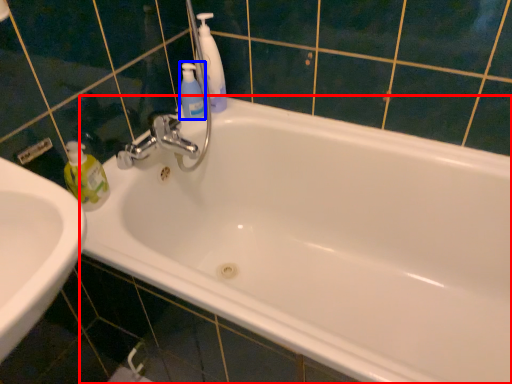
Question: Which point is further to the camera, bathtub (highlighted by a red box) or mouthwash (highlighted by a blue box)?

Choices:
 (A) bathtub
 (B) mouthwash

Answer: (B)